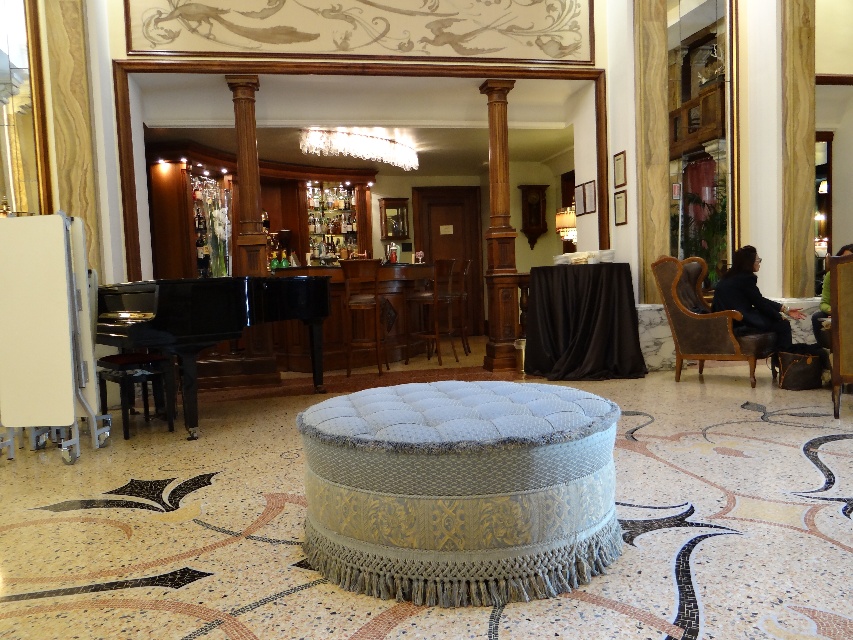
You are a server in this lounge and need to move a tray of drinks from the brown wooden bar stool at center to the brown leather armchair at center. The tray is 20 inches long. Can you safely carry it without bumping into anything between them?

The distance between the brown wooden bar stool at center and the brown leather armchair at center is 39.20 inches. Since the tray is 20 inches long, there is enough space to carry it safely without any obstruction.

You are planning to move the black polished piano at left to another room. Before doing so, you need to check if there is enough space between it and the brown polished wood column at center to safely move it out. Can you confirm if the piano can be moved without hitting the column?

The black polished piano at left is positioned under the brown polished wood column at center, so there is no space between them. Moving the piano would likely result in a collision with the column.

You are standing at the entrance of the lounge and want to move towards the black polished piano at left. Which direction should you walk to reach it?

Since the black polished piano at left is located at coordinate point 0.498 on the x axis and 0.244 on the y axis, you should walk towards the left side of the room to reach it.